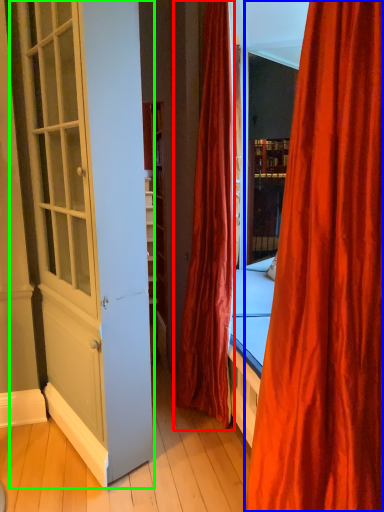
Question: Which object is the closest to the curtain (highlighted by a red box)? Choose among these: curtain (highlighted by a blue box) or screen door (highlighted by a green box).

Choices:
 (A) curtain
 (B) screen door

Answer: (B)